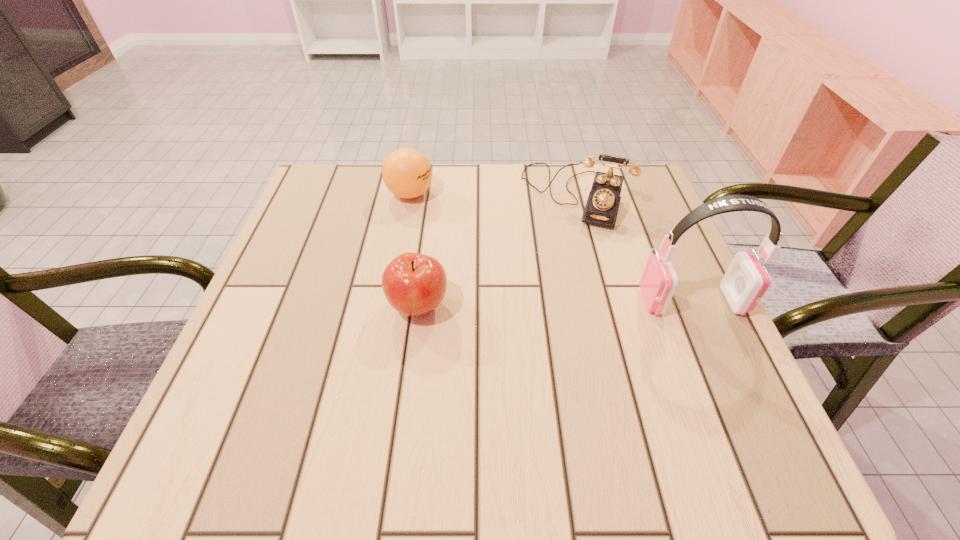
In order to click on vacant area at the near right corner of the desktop in this screenshot , I will do `click(675, 387)`.

You are a GUI agent. You are given a task and a screenshot of the screen. Output one action in this format:
    pyautogui.click(x=<x>, y=<y>)
    Task: Click on the free space between the ping-pong ball and the telephone
    
    Given the screenshot: What is the action you would take?
    pyautogui.click(x=492, y=194)

Where is `free spot between the apple and the tallest object`? Image resolution: width=960 pixels, height=540 pixels. free spot between the apple and the tallest object is located at coordinates (555, 303).

This screenshot has height=540, width=960. Identify the location of free space that is in between the earphone and the apple. (555, 303).

The width and height of the screenshot is (960, 540). In order to click on free spot between the telephone and the ping-pong ball in this screenshot , I will do `click(492, 194)`.

The width and height of the screenshot is (960, 540). In order to click on vacant area between the ping-pong ball and the telephone in this screenshot , I will do coord(492,194).

Find the location of a particular element. The image size is (960, 540). vacant area between the apple and the tallest object is located at coordinates (555, 303).

You are a GUI agent. You are given a task and a screenshot of the screen. Output one action in this format:
    pyautogui.click(x=<x>, y=<y>)
    Task: Click on the free space between the ping-pong ball and the tallest object
    
    Given the screenshot: What is the action you would take?
    pyautogui.click(x=551, y=247)

At what (x,y) coordinates should I click in order to perform the action: click on empty space between the ping-pong ball and the earphone. Please return your answer as a coordinate pair (x, y). Image resolution: width=960 pixels, height=540 pixels. Looking at the image, I should click on (551, 247).

What are the coordinates of `vacant point located between the tallest object and the ping-pong ball` in the screenshot? It's located at (551, 247).